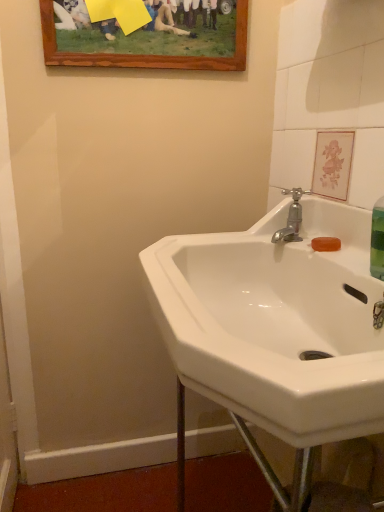
What is the approximate width of white glossy sink at center?

white glossy sink at center is 17.73 inches in width.

What do you see at coordinates (291, 218) in the screenshot? I see `silver metallic faucet at upper right` at bounding box center [291, 218].

You are a GUI agent. You are given a task and a screenshot of the screen. Output one action in this format:
    pyautogui.click(x=<x>, y=<y>)
    Task: Click on the silver metallic faucet at upper right
    The height and width of the screenshot is (512, 384).
    Given the screenshot: What is the action you would take?
    pyautogui.click(x=291, y=218)

Measure the distance between wooden picture frame at upper center and camera.

wooden picture frame at upper center and camera are 38.54 inches apart.

The width and height of the screenshot is (384, 512). I want to click on white glossy sink at center, so click(276, 332).

Is silver metallic faucet at upper right inside the boundaries of white glossy sink at center, or outside?

silver metallic faucet at upper right is located inside white glossy sink at center.

Is silver metallic faucet at upper right far away from white glossy sink at center?

No, silver metallic faucet at upper right is in close proximity to white glossy sink at center.

Looking at this image, in terms of height, does silver metallic faucet at upper right look taller or shorter compared to white glossy sink at center?

silver metallic faucet at upper right is shorter than white glossy sink at center.

Considering the sizes of silver metallic faucet at upper right and white glossy sink at center in the image, is silver metallic faucet at upper right wider or thinner than white glossy sink at center?

In the image, silver metallic faucet at upper right appears to be more narrow than white glossy sink at center.

In the scene shown: Is silver metallic faucet at upper right located within wooden picture frame at upper center?

That's incorrect, silver metallic faucet at upper right is not inside wooden picture frame at upper center.

From a real-world perspective, is wooden picture frame at upper center above or below silver metallic faucet at upper right?

Clearly, from a real-world perspective, wooden picture frame at upper center is above silver metallic faucet at upper right.

Can you confirm if wooden picture frame at upper center is bigger than white glossy sink at center?

No.

Which object is thinner, wooden picture frame at upper center or white glossy sink at center?

Thinner between the two is wooden picture frame at upper center.

Is wooden picture frame at upper center facing away from white glossy sink at center?

No, wooden picture frame at upper center is not facing away from white glossy sink at center.

Are white glossy sink at center and wooden picture frame at upper center making contact?

There is a gap between white glossy sink at center and wooden picture frame at upper center.

Between white glossy sink at center and wooden picture frame at upper center, which one has smaller width?

wooden picture frame at upper center is thinner.

In the image, is white glossy sink at center positioned in front of or behind wooden picture frame at upper center?

white glossy sink at center is positioned closer to the viewer than wooden picture frame at upper center.

I want to click on picture frame on the left of the white glossy sink at center, so click(x=144, y=34).

Is point (276, 234) positioned before point (56, 12)?

Yes, point (276, 234) is in front of point (56, 12).

Is wooden picture frame at upper center completely or partially inside silver metallic faucet at upper right?

No, wooden picture frame at upper center is not inside silver metallic faucet at upper right.

Can you confirm if silver metallic faucet at upper right is thinner than wooden picture frame at upper center?

No.

What's the angular difference between white glossy sink at center and silver metallic faucet at upper right's facing directions?

1.78 degrees separate the facing orientations of white glossy sink at center and silver metallic faucet at upper right.

Is white glossy sink at center positioned with its back to silver metallic faucet at upper right?

Absolutely, white glossy sink at center is directed away from silver metallic faucet at upper right.

From a real-world perspective, is white glossy sink at center under silver metallic faucet at upper right?

Yes, from a real-world perspective, white glossy sink at center is under silver metallic faucet at upper right.

You are a GUI agent. You are given a task and a screenshot of the screen. Output one action in this format:
    pyautogui.click(x=<x>, y=<y>)
    Task: Click on the tap to the right of white glossy sink at center
    This screenshot has width=384, height=512.
    Given the screenshot: What is the action you would take?
    pyautogui.click(x=291, y=218)

This screenshot has height=512, width=384. I want to click on tap located underneath the wooden picture frame at upper center (from a real-world perspective), so click(291, 218).

Estimate the real-world distances between objects in this image. Which object is closer to wooden picture frame at upper center, silver metallic faucet at upper right or white glossy sink at center?

silver metallic faucet at upper right is closer to wooden picture frame at upper center.

Based on their spatial positions, is wooden picture frame at upper center or white glossy sink at center further from silver metallic faucet at upper right?

wooden picture frame at upper center lies further to silver metallic faucet at upper right than the other object.

Estimate the real-world distances between objects in this image. Which object is closer to wooden picture frame at upper center, white glossy sink at center or silver metallic faucet at upper right?

silver metallic faucet at upper right.

Based on their spatial positions, is white glossy sink at center or wooden picture frame at upper center further from silver metallic faucet at upper right?

wooden picture frame at upper center.

Looking at the image, which one is located further to white glossy sink at center, silver metallic faucet at upper right or wooden picture frame at upper center?

Based on the image, wooden picture frame at upper center appears to be further to white glossy sink at center.

Considering their positions, is wooden picture frame at upper center positioned further to white glossy sink at center than silver metallic faucet at upper right?

The object further to white glossy sink at center is wooden picture frame at upper center.

Image resolution: width=384 pixels, height=512 pixels. I want to click on tap located between white glossy sink at center and wooden picture frame at upper center in the depth direction, so click(x=291, y=218).